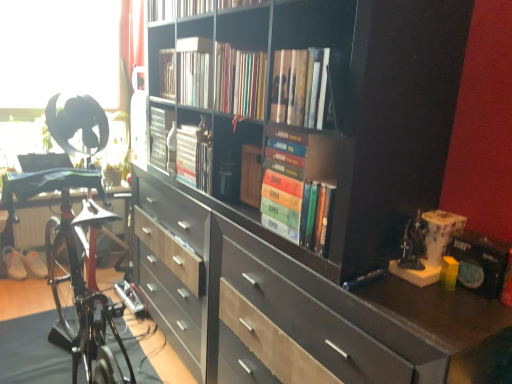
I want to click on free location to the left of matte black paperback book at right, so click(x=420, y=296).